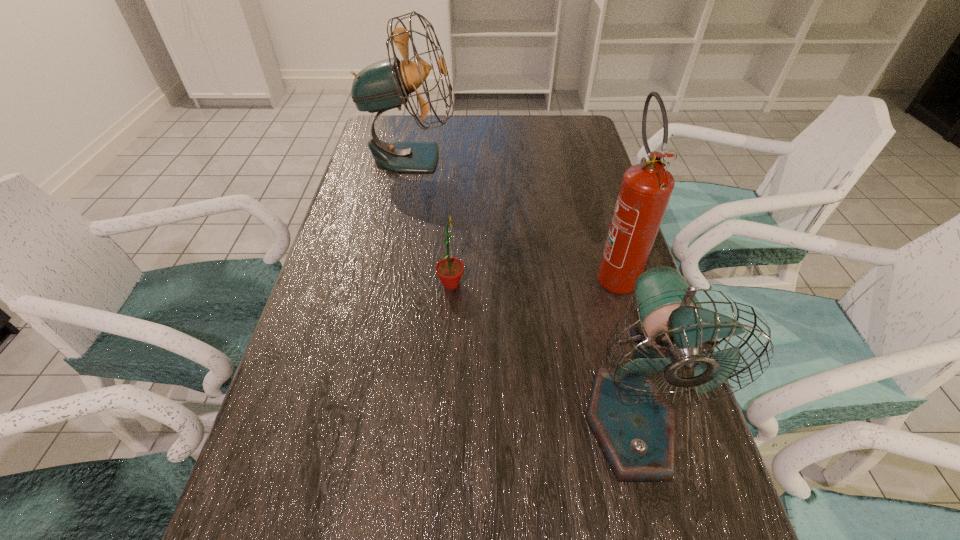
You are a GUI agent. You are given a task and a screenshot of the screen. Output one action in this format:
    pyautogui.click(x=<x>, y=<y>)
    Task: Click on the farthest object
    The image size is (960, 540).
    Given the screenshot: What is the action you would take?
    pyautogui.click(x=384, y=85)

This screenshot has width=960, height=540. Identify the location of the left fan. (384, 85).

This screenshot has height=540, width=960. I want to click on fire extinguisher, so click(646, 188).

Image resolution: width=960 pixels, height=540 pixels. In order to click on the right fan in this screenshot , I will do `click(631, 420)`.

Locate an element on the screen. the nearer fan is located at coordinates (631, 420).

Where is `the shortest object`? This screenshot has height=540, width=960. the shortest object is located at coordinates (449, 270).

The image size is (960, 540). Identify the location of vacant space located on the front-facing side of the farthest object for air flow. pyautogui.click(x=560, y=157).

Identify the location of free location located from the nozzle of the fire extinguisher. This screenshot has height=540, width=960. (674, 472).

Identify the location of free spot located 0.060m in front of the nearest object where the wind blows. The image size is (960, 540). (655, 523).

Where is `vacant space located on the face of the sunflower`? vacant space located on the face of the sunflower is located at coordinates (534, 284).